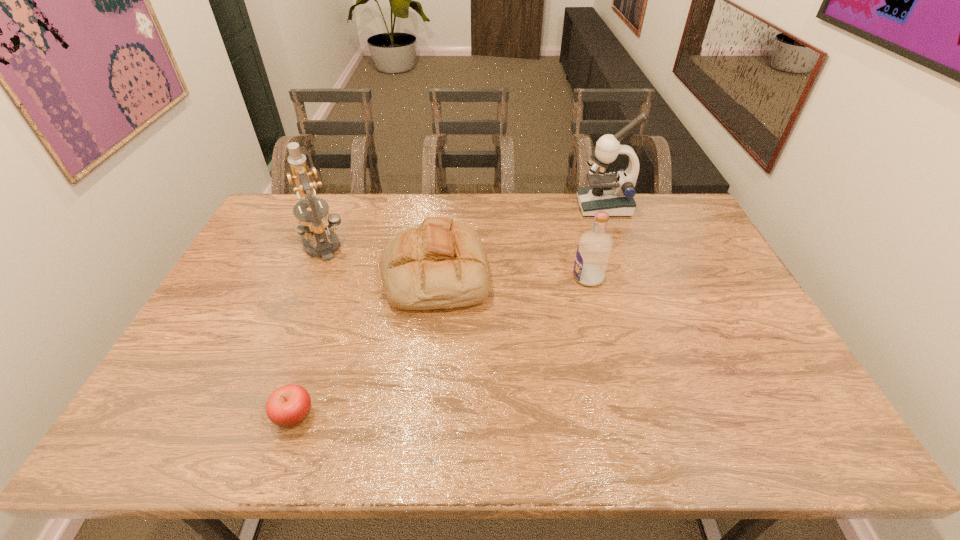
Find the location of a particular element. the nearer microscope is located at coordinates (314, 223).

You are a GUI agent. You are given a task and a screenshot of the screen. Output one action in this format:
    pyautogui.click(x=<x>, y=<y>)
    Task: Click on the right microscope
    The width and height of the screenshot is (960, 540).
    Given the screenshot: What is the action you would take?
    pyautogui.click(x=612, y=193)

Identify the location of the farther microscope. (612, 193).

Find the location of `vodka`. vodka is located at coordinates (593, 252).

Where is `bread`? The height and width of the screenshot is (540, 960). bread is located at coordinates (441, 263).

The height and width of the screenshot is (540, 960). What are the coordinates of `the third object from left to right` in the screenshot? It's located at coord(441,263).

The width and height of the screenshot is (960, 540). What are the coordinates of `the nearest object` in the screenshot? It's located at (289, 405).

The height and width of the screenshot is (540, 960). What are the coordinates of `the shortest object` in the screenshot? It's located at (289, 405).

You are a GUI agent. You are given a task and a screenshot of the screen. Output one action in this format:
    pyautogui.click(x=<x>, y=<y>)
    Task: Click on the vacant space located on the front of the left microscope
    The height and width of the screenshot is (540, 960).
    Given the screenshot: What is the action you would take?
    pyautogui.click(x=275, y=356)

What are the coordinates of `free space located on the left of the right microscope` in the screenshot? It's located at (482, 206).